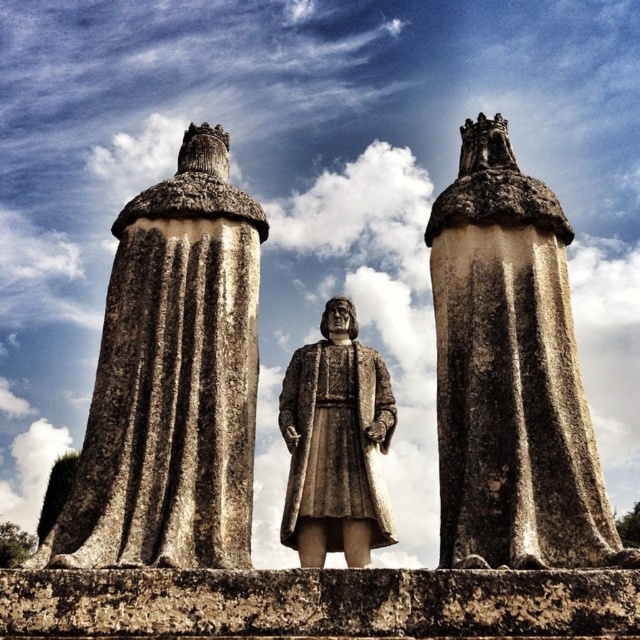
The height and width of the screenshot is (640, 640). What are the coordinates of `stone column at center` in the screenshot? It's located at (509, 372).

Does stone column at center appear under fur-like brown robe at center?

Incorrect, stone column at center is not positioned below fur-like brown robe at center.

Is point (476, 225) closer to camera compared to point (337, 422)?

No, it is not.

Find the location of `stone column at center`. stone column at center is located at coordinates (509, 372).

Between stone statue at left and fur-like brown robe at center, which one is positioned lower?

fur-like brown robe at center

From the picture: Between stone statue at left and fur-like brown robe at center, which one appears on the left side from the viewer's perspective?

From the viewer's perspective, stone statue at left appears more on the left side.

Between point (125, 340) and point (333, 429), which one is positioned behind?

The point (125, 340) is more distant.

This screenshot has width=640, height=640. Find the location of `stone statue at left`. stone statue at left is located at coordinates (172, 380).

Describe the element at coordinates (172, 380) in the screenshot. Image resolution: width=640 pixels, height=640 pixels. I see `stone statue at left` at that location.

Who is taller, stone statue at left or stone column at center?

With more height is stone column at center.

Who is more forward, (228, 384) or (580, 560)?

Positioned in front is point (580, 560).

In order to click on stone statue at left in this screenshot , I will do `click(172, 380)`.